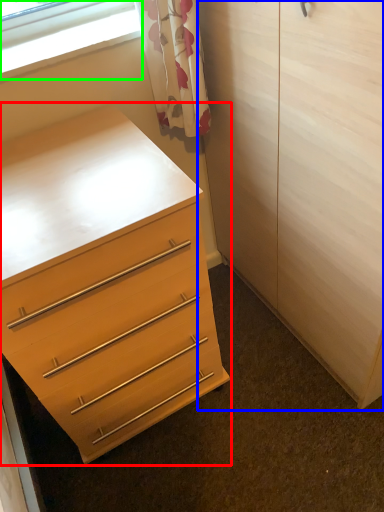
Question: Which object is positioned farthest from chest of drawers (highlighted by a red box)? Select from armoire (highlighted by a blue box) and window (highlighted by a green box).

Choices:
 (A) armoire
 (B) window

Answer: (B)